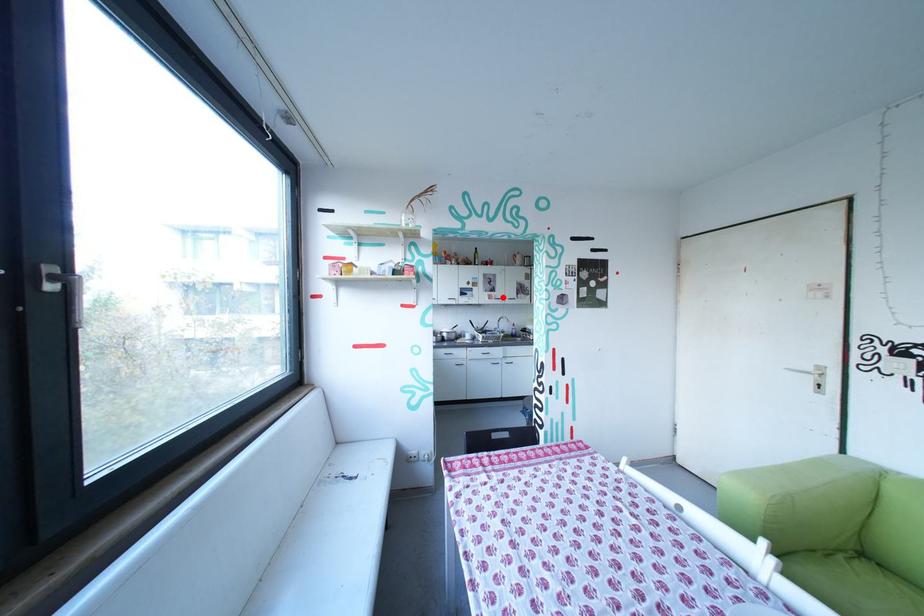
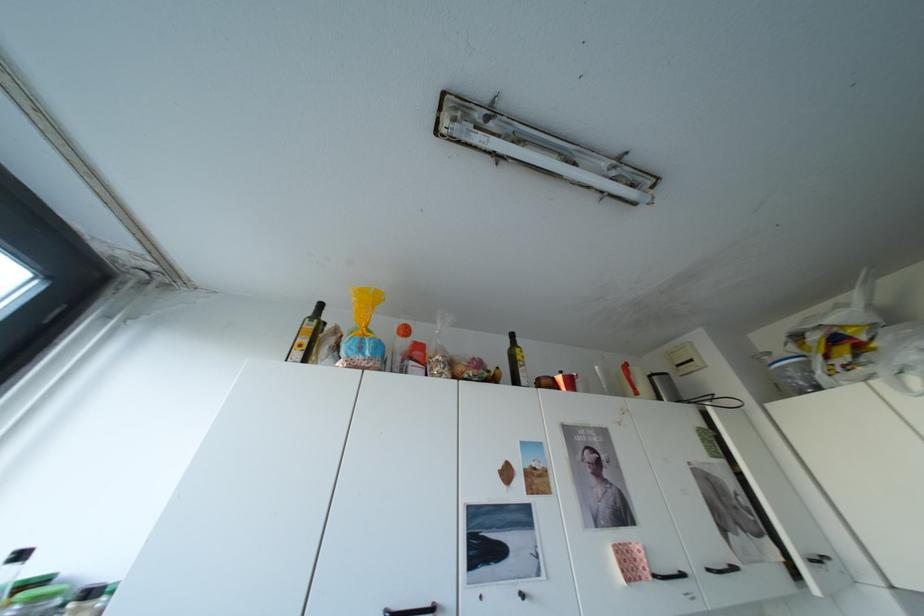
The point at the highlighted location is marked in the first image. Where is the corresponding point in the second image?

(642, 568)